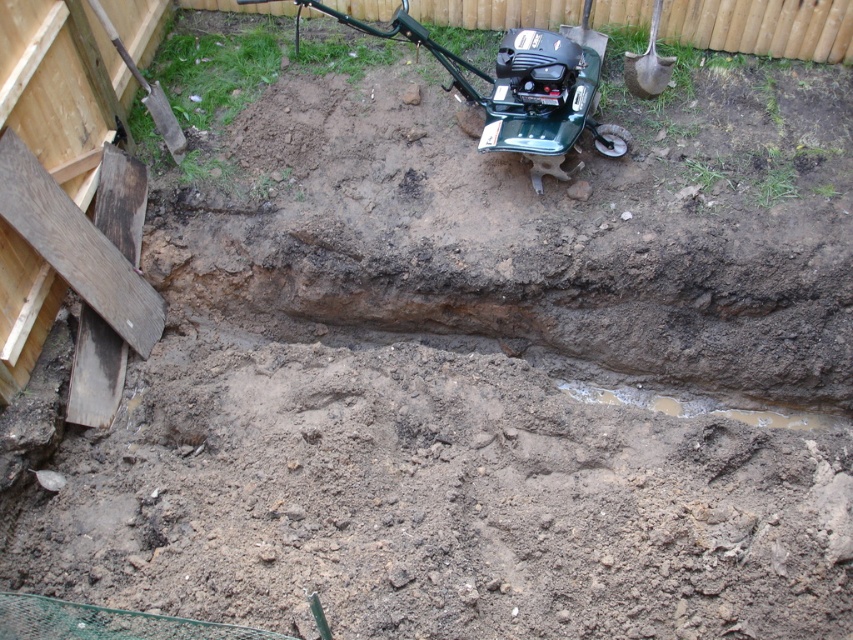
You are standing at the point with coordinates (520, 88) in the construction site. What object are you standing on?

The point (520, 88) corresponds to the green metallic mower at center, so you are standing on the green metallic mower at center.

You are a gardener who needs to transport both the green metallic mower at center and the wooden shovel at upper left across a narrow path that is only as wide as the wider object. Which object determines the minimum width of the path required?

The green metallic mower at center is wider than the wooden shovel at upper left, so the path must be at least as wide as the green metallic mower at center to accommodate both objects.

You are a construction worker who needs to choose a shovel to dig a hole. You have two options in the scene, the wooden shovel at upper left and the brown wooden shovel at upper right. Which shovel is taller and more suitable for digging?

The wooden shovel at upper left is much taller than the brown wooden shovel at upper right, so it is more suitable for digging.